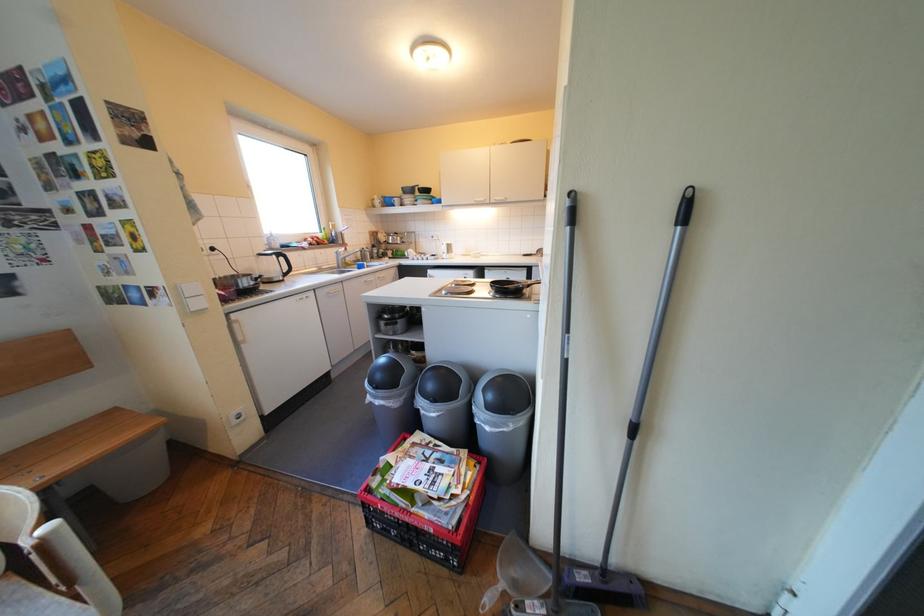
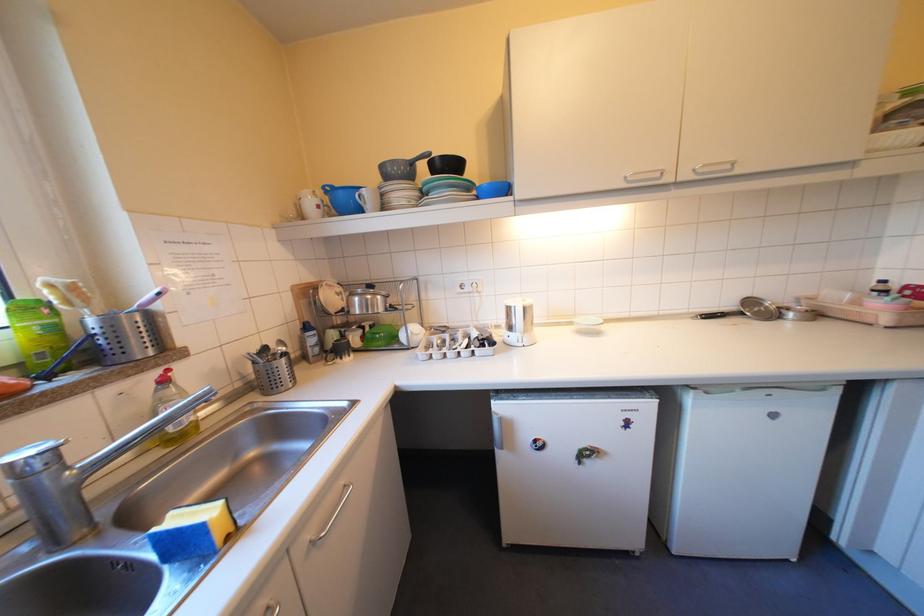
Find the pixel in the second image that matches [395,251] in the first image.

(346, 334)